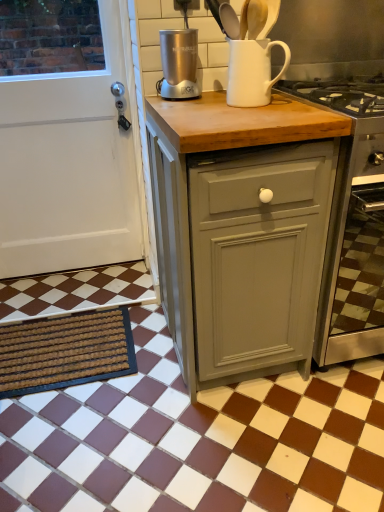
Where is `free space to the left of matte gray cabinet at center`? The width and height of the screenshot is (384, 512). free space to the left of matte gray cabinet at center is located at coordinates (121, 382).